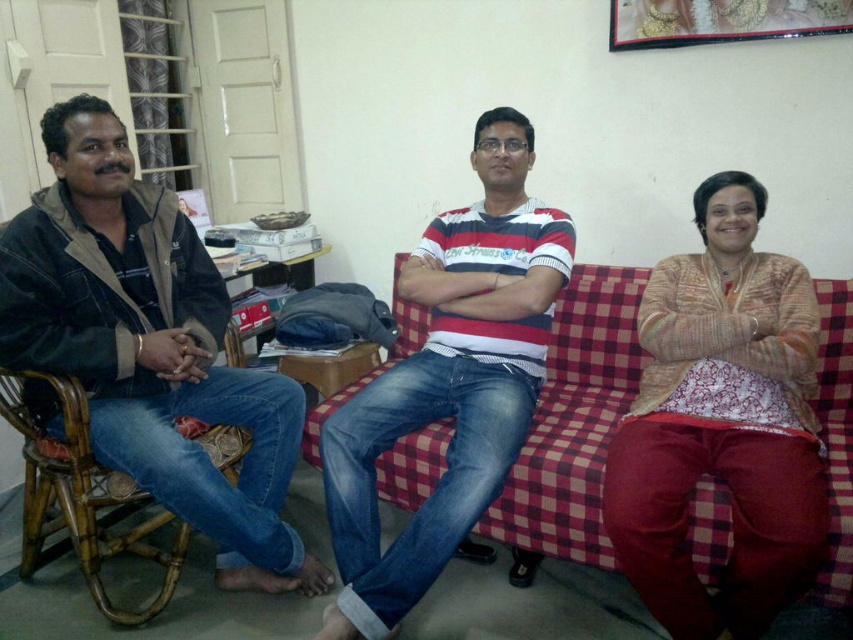
Question: Can you confirm if denim jeans at left is positioned to the right of checkered fabric couch at center?

Choices:
 (A) no
 (B) yes

Answer: (A)

Question: Does striped cotton shirt at center have a greater width compared to gold metallic picture frame at upper center?

Choices:
 (A) yes
 (B) no

Answer: (A)

Question: Among these objects, which one is nearest to the camera?

Choices:
 (A) striped cotton shirt at center
 (B) checkered fabric couch at center
 (C) denim jeans at left

Answer: (B)

Question: Is bamboo armchair at left bigger than gold metallic picture frame at upper center?

Choices:
 (A) yes
 (B) no

Answer: (A)

Question: Estimate the real-world distances between objects in this image. Which object is closer to the checkered fabric couch at center?

Choices:
 (A) bamboo armchair at left
 (B) beige textured sweater at center
 (C) gold metallic picture frame at upper center
 (D) striped cotton shirt at center

Answer: (B)

Question: Which object is positioned farthest from the gold metallic picture frame at upper center?

Choices:
 (A) bamboo armchair at left
 (B) beige textured sweater at center
 (C) striped cotton shirt at center
 (D) denim jeans at left

Answer: (A)